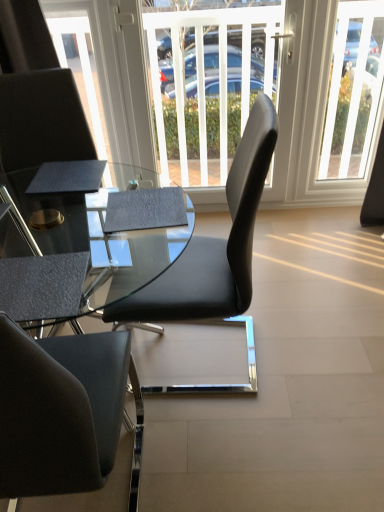
Image resolution: width=384 pixels, height=512 pixels. I want to click on blank space above textured black armchair at lower left (from a real-world perspective), so click(37, 281).